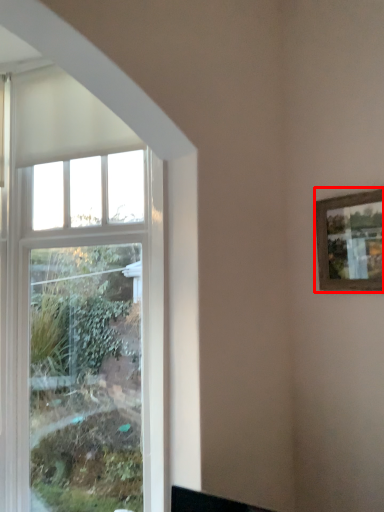
Question: Considering the relative positions of picture frame (annotated by the red box) and window in the image provided, where is picture frame (annotated by the red box) located with respect to the staircase?

Choices:
 (A) left
 (B) right

Answer: (B)